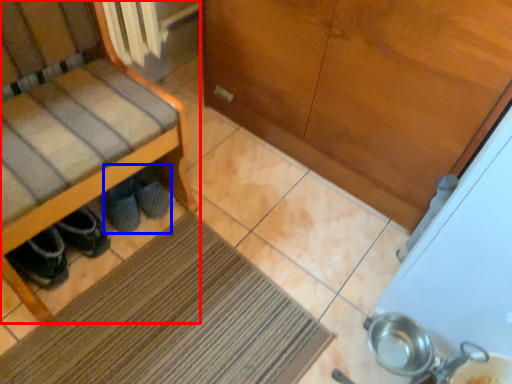
Question: Which object appears farthest to the camera in this image, furniture (highlighted by a red box) or footwear (highlighted by a blue box)?

Choices:
 (A) furniture
 (B) footwear

Answer: (B)